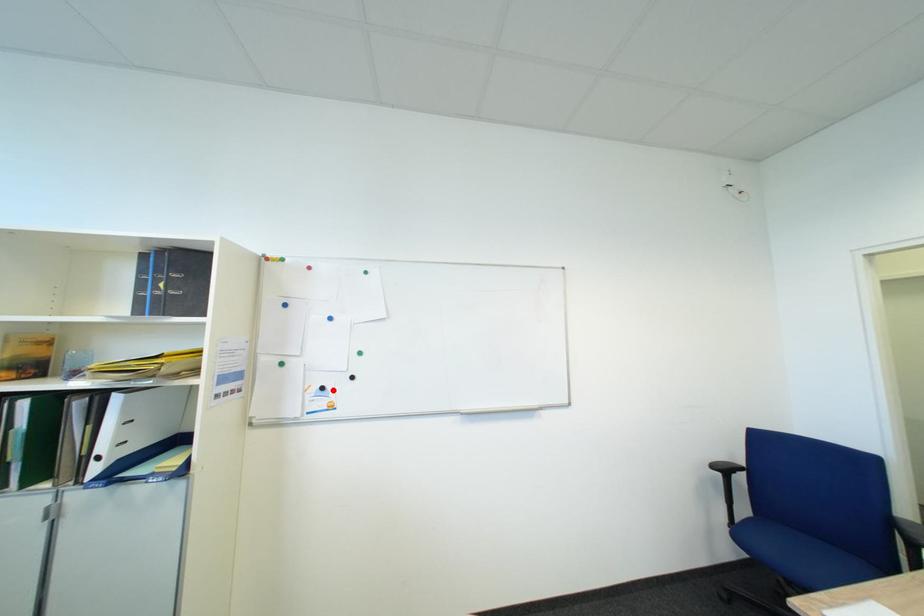
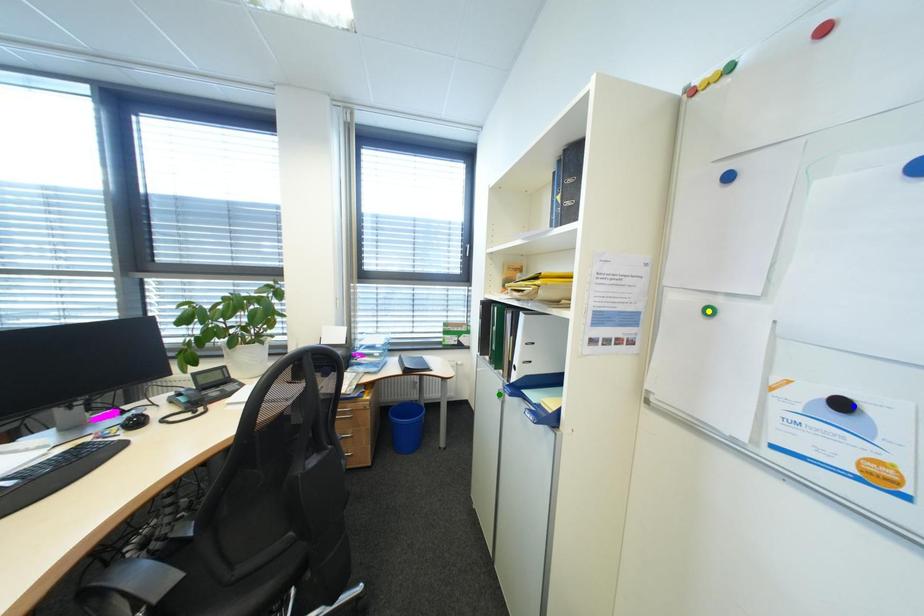
Question: I am providing you with two images of the same scene from different viewpoints. A red point is marked on the first image. You are given multiple points on the second image. Which point in image 2 is actually the same real-world point as the red point in image 1?

Choices:
 (A) yellow point
 (B) green point
 (C) blue point

Answer: (C)